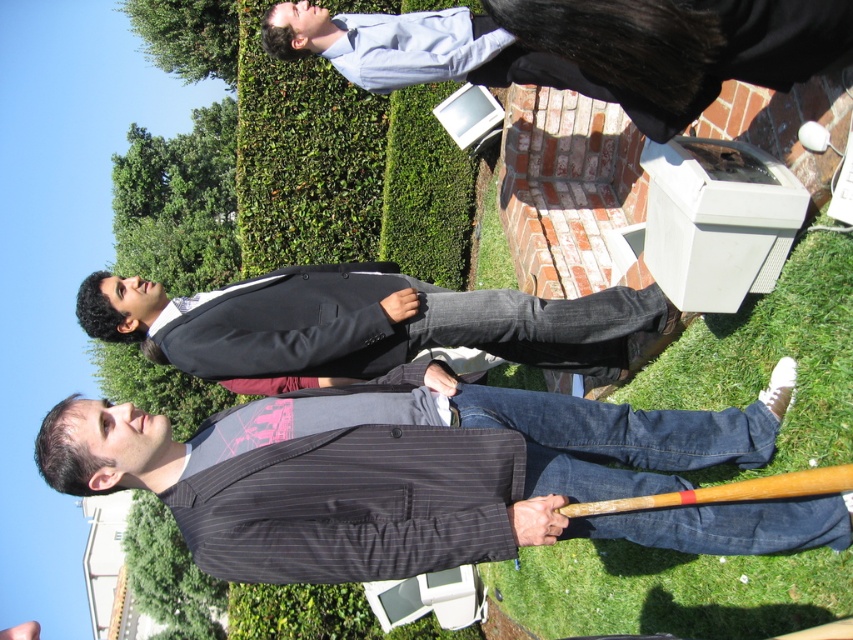
Question: Which point is farther to the camera?

Choices:
 (A) black pinstripe suit at center
 (B) striped pinstripe suit at center
 (C) green grass at lower right
 (D) wooden baseball bat at lower center

Answer: (A)

Question: Among these points, which one is farthest from the camera?

Choices:
 (A) (480, 483)
 (B) (728, 483)
 (C) (418, 16)

Answer: (C)

Question: Can you confirm if striped pinstripe suit at center is thinner than green grass at lower right?

Choices:
 (A) yes
 (B) no

Answer: (B)

Question: Which object is the farthest from the black pinstripe suit at center?

Choices:
 (A) green grass at lower right
 (B) wooden baseball bat at lower center
 (C) light blue shirt at upper center

Answer: (A)

Question: Does light blue shirt at upper center appear on the left side of black pinstripe suit at center?

Choices:
 (A) no
 (B) yes

Answer: (A)

Question: Can you confirm if green grass at lower right is positioned below light blue shirt at upper center?

Choices:
 (A) yes
 (B) no

Answer: (A)